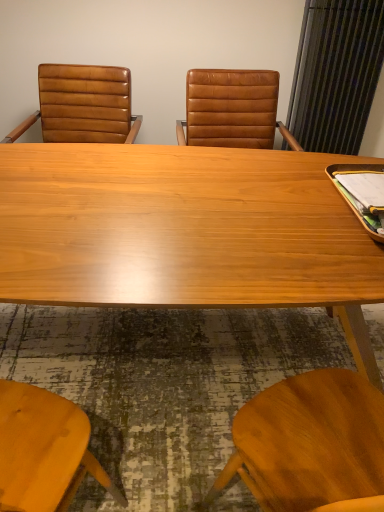
The width and height of the screenshot is (384, 512). Describe the element at coordinates (83, 105) in the screenshot. I see `matte brown leather chair at left` at that location.

Identify the location of matte brown leather chair at left. The height and width of the screenshot is (512, 384). (83, 105).

Locate an element on the screen. Image resolution: width=384 pixels, height=512 pixels. wooden desk at center is located at coordinates pyautogui.click(x=185, y=232).

Measure the distance between wooden desk at center and camera.

They are 33.84 inches apart.

What is the approximate width of wooden desk at center?

36.50 inches.

The image size is (384, 512). What do you see at coordinates (185, 232) in the screenshot?
I see `wooden desk at center` at bounding box center [185, 232].

The height and width of the screenshot is (512, 384). I want to click on matte brown leather chair at left, so click(83, 105).

Considering the relative positions of matte brown leather chair at left and wooden desk at center in the image provided, is matte brown leather chair at left to the right of wooden desk at center from the viewer's perspective?

In fact, matte brown leather chair at left is to the left of wooden desk at center.

Which object is further away from the camera, matte brown leather chair at left or wooden desk at center?

matte brown leather chair at left is behind.

Does point (87, 111) appear closer or farther from the camera than point (208, 249)?

Point (87, 111) is farther from the camera than point (208, 249).

From the image's perspective, does matte brown leather chair at left appear lower than wooden desk at center?

Incorrect, from the image's perspective, matte brown leather chair at left is higher than wooden desk at center.

Based on the photo, from a real-world perspective, is matte brown leather chair at left physically located above or below wooden desk at center?

Clearly, from a real-world perspective, matte brown leather chair at left is above wooden desk at center.

Which object is thinner, matte brown leather chair at left or wooden desk at center?

With smaller width is matte brown leather chair at left.

Does matte brown leather chair at left have a greater height compared to wooden desk at center?

No.

Can you confirm if matte brown leather chair at left is bigger than wooden desk at center?

Actually, matte brown leather chair at left might be smaller than wooden desk at center.

Can we say matte brown leather chair at left lies outside wooden desk at center?

That's correct, matte brown leather chair at left is outside of wooden desk at center.

Is matte brown leather chair at left beside wooden desk at center?

No, matte brown leather chair at left is not touching wooden desk at center.

Is matte brown leather chair at left facing away from wooden desk at center?

No, wooden desk at center is not at the back of matte brown leather chair at left.

How many degrees apart are the facing directions of matte brown leather chair at left and wooden desk at center?

There is a 2.74-degree angle between the facing directions of matte brown leather chair at left and wooden desk at center.

How far apart are matte brown leather chair at left and wooden desk at center?

The distance of matte brown leather chair at left from wooden desk at center is 36.57 inches.

The image size is (384, 512). In order to click on chair behind the wooden desk at center in this screenshot , I will do `click(83, 105)`.

Does wooden desk at center appear on the left side of matte brown leather chair at left?

No.

Is wooden desk at center further to camera compared to matte brown leather chair at left?

No, wooden desk at center is closer to the camera.

Which is closer, [189,212] or [70,83]?

Point [189,212] is closer to the camera than point [70,83].

From the image's perspective, which is above, wooden desk at center or matte brown leather chair at left?

matte brown leather chair at left is shown above in the image.

From a real-world perspective, who is located higher, wooden desk at center or matte brown leather chair at left?

matte brown leather chair at left is physically above.

Is wooden desk at center wider or thinner than matte brown leather chair at left?

wooden desk at center is wider than matte brown leather chair at left.

Is wooden desk at center shorter than matte brown leather chair at left?

No, wooden desk at center is not shorter than matte brown leather chair at left.

Which of these two, wooden desk at center or matte brown leather chair at left, is bigger?

Bigger between the two is wooden desk at center.

Is wooden desk at center inside the boundaries of matte brown leather chair at left, or outside?

The correct answer is: outside.

Is wooden desk at center far away from matte brown leather chair at left?

They are positioned close to each other.

Is wooden desk at center looking in the opposite direction of matte brown leather chair at left?

Yes, wooden desk at center is facing away from matte brown leather chair at left.

Find the location of a particular element. Image resolution: width=384 pixels, height=512 pixels. chair behind the wooden desk at center is located at coordinates click(x=83, y=105).

I want to click on chair above the wooden desk at center (from the image's perspective), so click(x=83, y=105).

This screenshot has width=384, height=512. I want to click on desk in front of the matte brown leather chair at left, so click(185, 232).